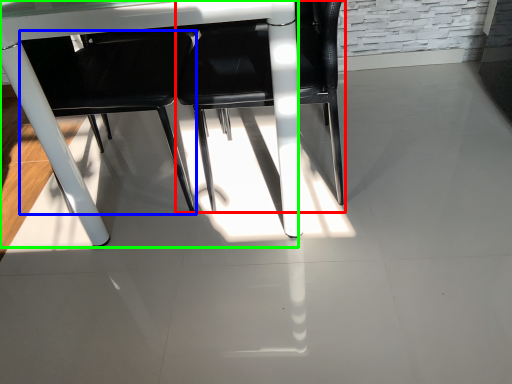
Question: Estimate the real-world distances between objects in this image. Which object is closer to chair (highlighted by a red box), chair (highlighted by a blue box) or table (highlighted by a green box)?

Choices:
 (A) chair
 (B) table

Answer: (A)